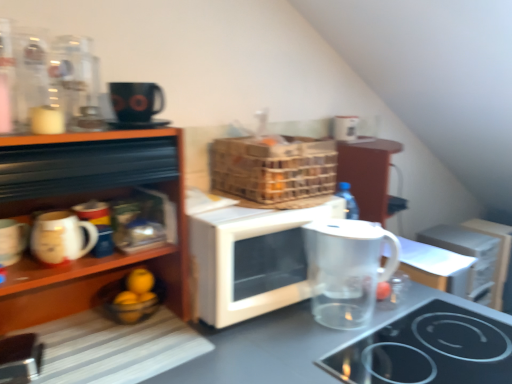
Question: Does transparent glass pitcher at center have a lesser width compared to transparent glass jug at lower right?

Choices:
 (A) no
 (B) yes

Answer: (A)

Question: Can transparent glass jug at lower right be found inside transparent glass pitcher at center?

Choices:
 (A) no
 (B) yes

Answer: (A)

Question: From the image's perspective, would you say transparent glass pitcher at center is positioned over transparent glass jug at lower right?

Choices:
 (A) yes
 (B) no

Answer: (B)

Question: Is transparent glass pitcher at center next to transparent glass jug at lower right?

Choices:
 (A) no
 (B) yes

Answer: (A)

Question: Considering the relative sizes of transparent glass pitcher at center and transparent glass jug at lower right in the image provided, is transparent glass pitcher at center bigger than transparent glass jug at lower right?

Choices:
 (A) yes
 (B) no

Answer: (A)

Question: Would you say white glossy mug at lower left, which is the second mug in left-to-right order, is inside or outside white matte microwave at center?

Choices:
 (A) outside
 (B) inside

Answer: (A)

Question: Is white glossy mug at lower left, which is the second mug in left-to-right order, bigger or smaller than white matte microwave at center?

Choices:
 (A) small
 (B) big

Answer: (A)

Question: Considering their positions, is white glossy mug at lower left, acting as the first mug starting from the right, located in front of or behind white matte microwave at center?

Choices:
 (A) front
 (B) behind

Answer: (A)

Question: Looking at their shapes, would you say white glossy mug at lower left, which is the second mug in left-to-right order, is wider or thinner than white matte microwave at center?

Choices:
 (A) thin
 (B) wide

Answer: (A)

Question: From the image's perspective, is transparent plastic pitcher at lower right positioned above or below wooden shelves at left?

Choices:
 (A) below
 (B) above

Answer: (A)

Question: Does point (457, 286) appear closer or farther from the camera than point (181, 157)?

Choices:
 (A) closer
 (B) farther

Answer: (B)

Question: From a real-world perspective, is transparent plastic pitcher at lower right positioned above or below wooden shelves at left?

Choices:
 (A) above
 (B) below

Answer: (B)

Question: Is transparent plastic pitcher at lower right taller or shorter than wooden shelves at left?

Choices:
 (A) short
 (B) tall

Answer: (A)

Question: From the image's perspective, is white matte microwave at center positioned above or below black glass cooktop at lower right?

Choices:
 (A) below
 (B) above

Answer: (B)

Question: Would you say white matte microwave at center is inside or outside black glass cooktop at lower right?

Choices:
 (A) outside
 (B) inside

Answer: (A)